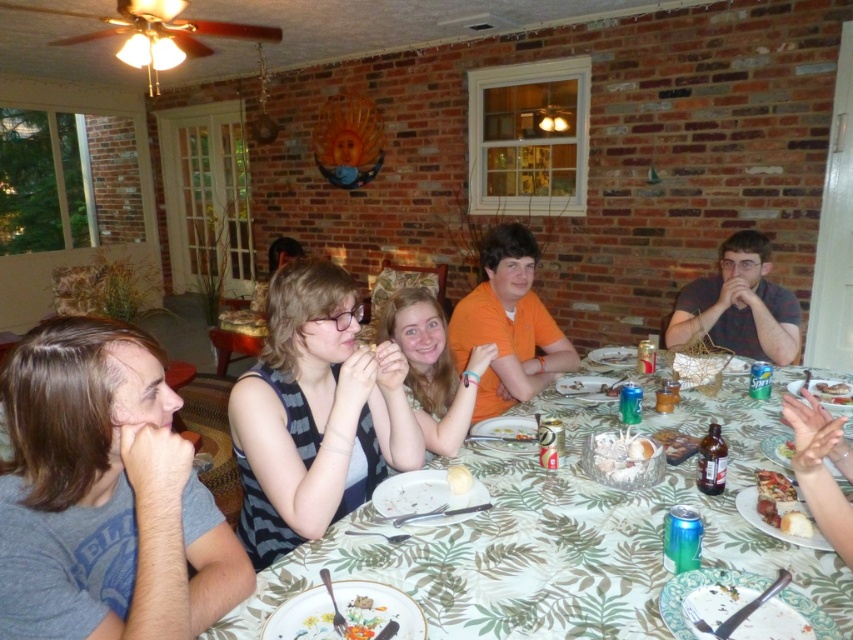
You are a photographer trying to capture a closeup of the white creamy cake at center. You notice the smooth orange shirt at center is blocking your view. Can you determine if the cake is visible behind the shirt?

The smooth orange shirt at center is taller than white creamy cake at center, so the shirt is blocking the cake and it is not visible behind it.

You are a guest at this dinner and want to place your napkin on the table. If you want to place it somewhere between the translucent glass bowl at center and the white fluffy bread at lower right, will the space between them be enough for the napkin?

The translucent glass bowl at center is taller than the white fluffy bread at lower right, but the question is about the space between them. Since the description only mentions height, not horizontal distance, we cannot determine if the space is sufficient for the napkin based on the provided information.